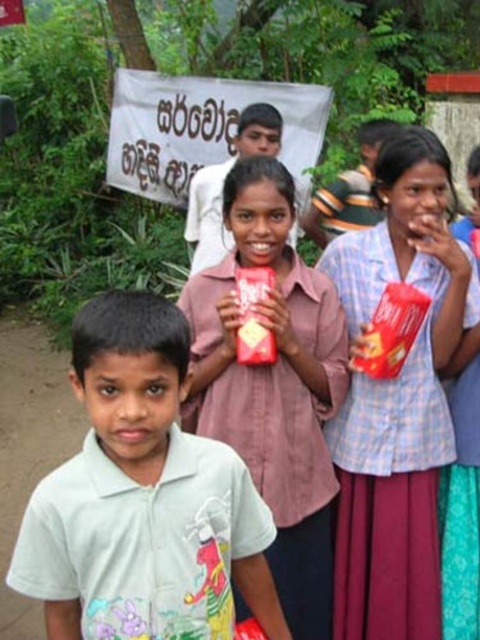
Question: Which point appears farthest from the camera in this image?

Choices:
 (A) (324, 243)
 (B) (131, 547)

Answer: (A)

Question: Considering the relative positions of light green cotton shirt at center and matte plastic cup at center in the image provided, where is light green cotton shirt at center located with respect to matte plastic cup at center?

Choices:
 (A) above
 (B) below

Answer: (B)

Question: Can you confirm if matte plastic cup at right is smaller than matte plastic cup at center?

Choices:
 (A) no
 (B) yes

Answer: (B)

Question: Which point is farther to the camera?

Choices:
 (A) [x=85, y=381]
 (B) [x=463, y=403]
 (C) [x=189, y=204]

Answer: (C)

Question: Which object is the closest to the matte pink shirt at center?

Choices:
 (A) matte red box at center
 (B) matte plastic cup at right
 (C) matte plastic cup at center

Answer: (A)

Question: In this image, where is matte red box at center located relative to matte plastic boy at center?

Choices:
 (A) above
 (B) below

Answer: (B)